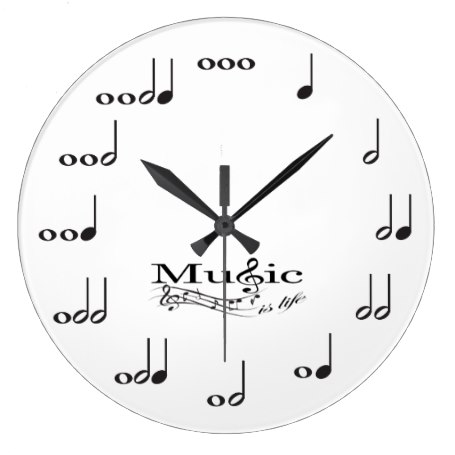
Find the location of a particular element. This screenshot has width=455, height=455. clock hands is located at coordinates (189, 194), (292, 172), (222, 264).